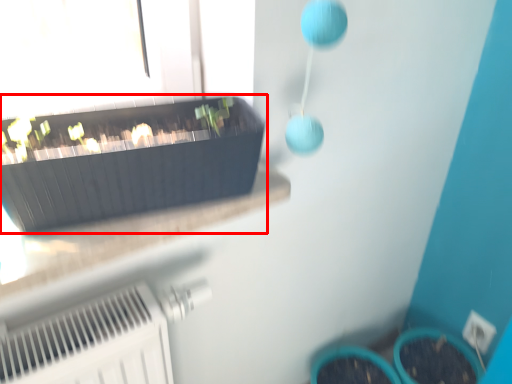
Question: Considering the relative positions of flowerpot (annotated by the red box) and electric outlet in the image provided, where is flowerpot (annotated by the red box) located with respect to the staircase?

Choices:
 (A) right
 (B) left

Answer: (B)